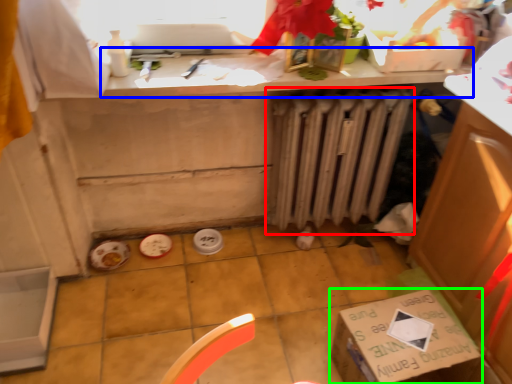
Question: Considering the real-world distances, which object is closest to radiator (highlighted by a red box)? countertop (highlighted by a blue box) or cardboard box (highlighted by a green box).

Choices:
 (A) countertop
 (B) cardboard box

Answer: (A)